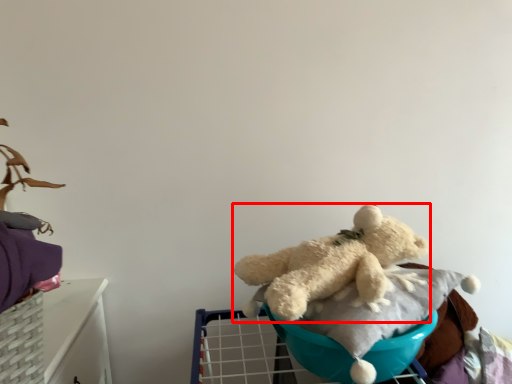
Question: From the image's perspective, what is the correct spatial relationship of teddy bear (annotated by the red box) in relation to baby carriage?

Choices:
 (A) above
 (B) below

Answer: (A)